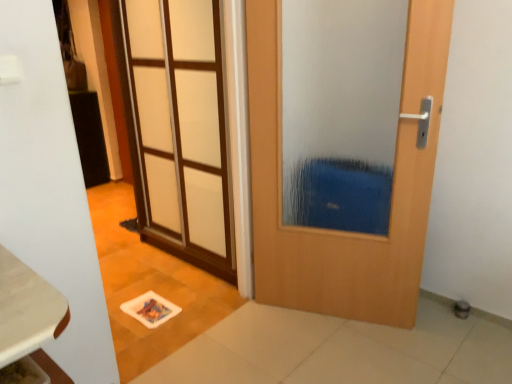
The width and height of the screenshot is (512, 384). Identify the location of free location in front of wooden door at center, which is counted as the first door, starting from the right. (343, 350).